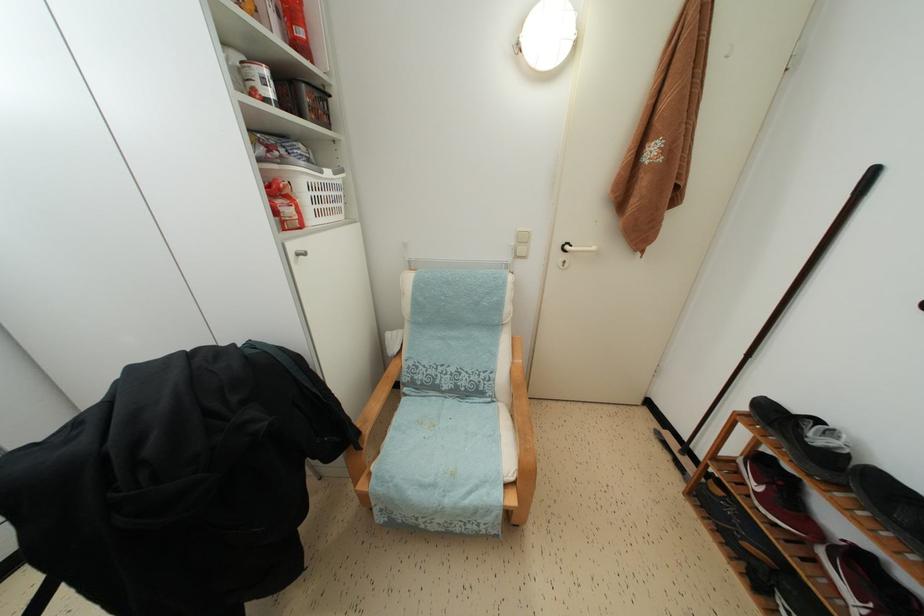
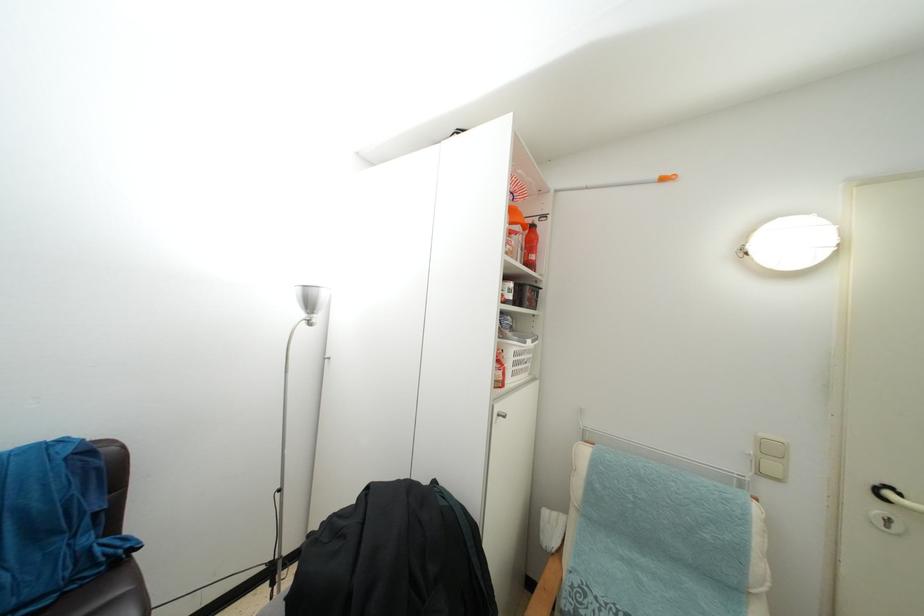
Locate, in the second image, the point that corresponds to pixel 572 253 in the first image.

(893, 500)